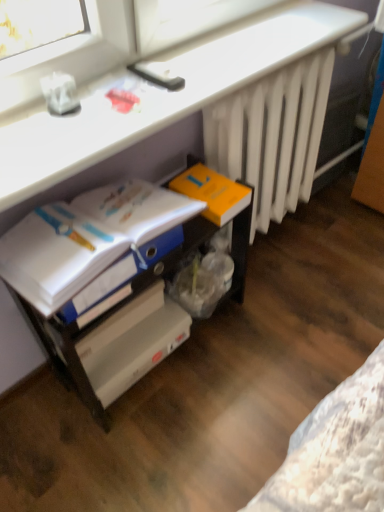
In order to click on vacant area that is situated to the right of white plastic file cabinet at lower center in this screenshot , I will do `click(277, 340)`.